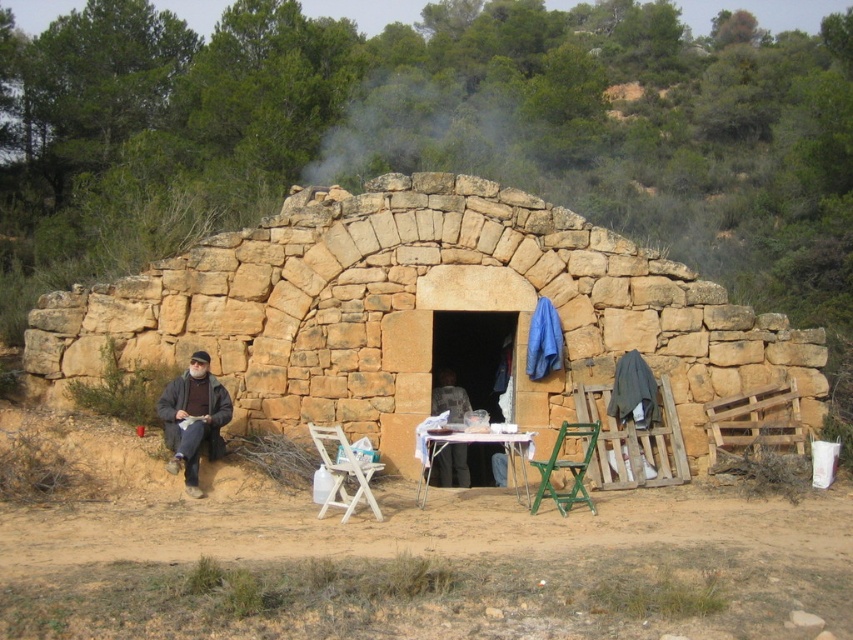
You are standing at the origin point of the coordinate system in the image. Which direction should you move to reach the natural stone hut at center?

Since the natural stone hut at center is located at coordinates approximately 0.489 on the x and y axes, you should move northeast to reach it from the origin point.

You are an explorer who just arrived at this rustic stone structure. You see the dark gray woolen sweater at left and the dark brown leather jacket at center. Which item is positioned lower in relation to the other?

The dark gray woolen sweater at left is located below the dark brown leather jacket at center, so it is positioned lower.

Please provide the coordinates of the white wood folding chair at lower center in the image.

The white wood folding chair at lower center is located at coordinates point (344, 472).